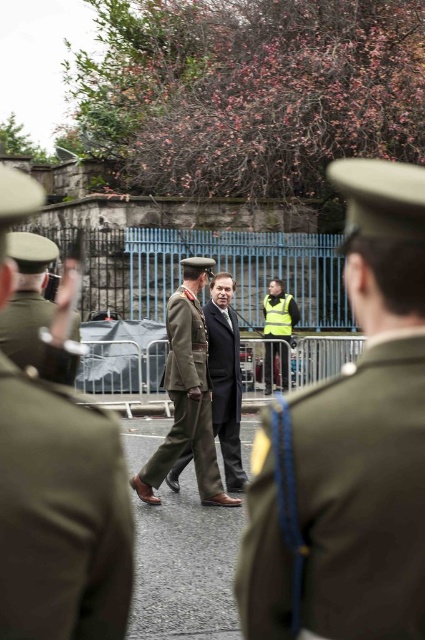
Question: Which point is farther to the camera?

Choices:
 (A) (167, 381)
 (B) (22, 253)
 (C) (416, 572)

Answer: (A)

Question: Does camouflage fabric uniform at center have a greater width compared to dark gray wool suit at center?

Choices:
 (A) no
 (B) yes

Answer: (B)

Question: Observing the image, what is the correct spatial positioning of dark brown leather shoes at center in reference to yellow reflective vest at center?

Choices:
 (A) above
 (B) below

Answer: (A)

Question: Is dark gray wool suit at center positioned behind yellow reflective vest at center?

Choices:
 (A) yes
 (B) no

Answer: (B)

Question: Among these objects, which one is farthest from the camera?

Choices:
 (A) camouflage fabric uniform at center
 (B) green military uniform at center

Answer: (A)

Question: Which point is farther from the camera taking this photo?

Choices:
 (A) (42, 500)
 (B) (299, 314)

Answer: (B)